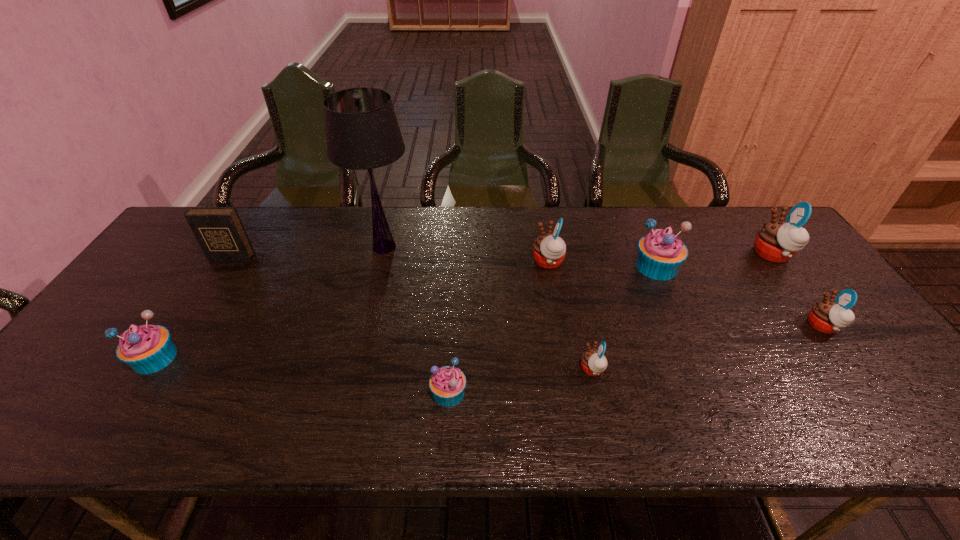
Find the location of a particular element. This screenshot has width=960, height=540. free space located 0.120m on the front-facing side of the third smallest pink muffin is located at coordinates (492, 261).

The height and width of the screenshot is (540, 960). Find the location of `free spot located 0.180m on the front-facing side of the third smallest pink muffin`. free spot located 0.180m on the front-facing side of the third smallest pink muffin is located at coordinates (472, 261).

Where is `free space located on the right of the fifth muffin from left to right`? The height and width of the screenshot is (540, 960). free space located on the right of the fifth muffin from left to right is located at coordinates (751, 267).

Where is `vacant space located on the front-facing side of the sixth farthest object`? This screenshot has width=960, height=540. vacant space located on the front-facing side of the sixth farthest object is located at coordinates (727, 326).

The image size is (960, 540). I want to click on free space located on the front-facing side of the sixth farthest object, so click(x=769, y=326).

What are the coordinates of `vacant space located 0.310m on the front-facing side of the sixth farthest object` in the screenshot? It's located at (688, 326).

I want to click on free location located 0.250m on the back of the second biggest blue muffin, so click(x=211, y=273).

You are a GUI agent. You are given a task and a screenshot of the screen. Output one action in this format:
    pyautogui.click(x=<x>, y=<y>)
    Task: Click on the blank space located 0.100m on the front-facing side of the nearest pink muffin
    The image size is (960, 540).
    Given the screenshot: What is the action you would take?
    pyautogui.click(x=538, y=369)

At what (x,y) coordinates should I click in order to perform the action: click on vacant space located on the front-facing side of the nearest pink muffin. Please return your answer as a coordinate pair (x, y). Image resolution: width=960 pixels, height=540 pixels. Looking at the image, I should click on (520, 369).

Identify the location of blank space located on the front-facing side of the nearest pink muffin. (541, 369).